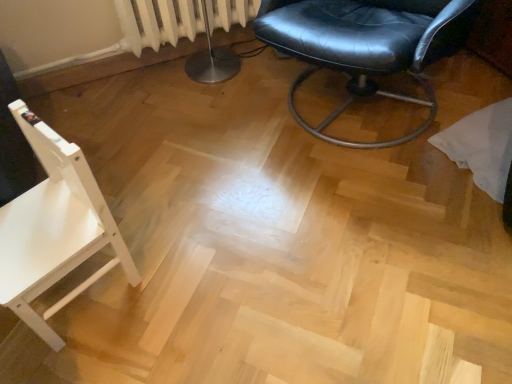
Where is `free point below white wood chair at left, arranged as the second chair when viewed from the top (from a real-world perspective)`? The image size is (512, 384). free point below white wood chair at left, arranged as the second chair when viewed from the top (from a real-world perspective) is located at coordinates (88, 300).